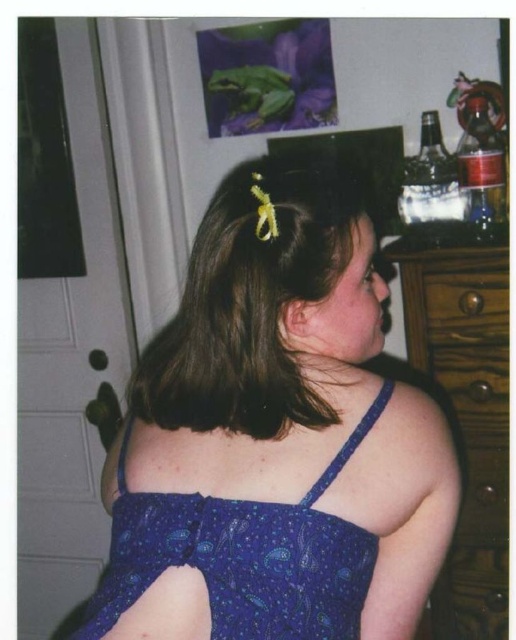
Question: Which of these objects is positioned closest to the brown wooden drawer at right?

Choices:
 (A) blue satin dress at center
 (B) wooden dresser at right

Answer: (B)

Question: Does brown matte hair clip at upper center have a smaller size compared to wooden dresser at right?

Choices:
 (A) no
 (B) yes

Answer: (B)

Question: Which of the following is the closest to the observer?

Choices:
 (A) (307, 316)
 (B) (457, 272)

Answer: (A)

Question: Is blue paisley fabric dress at back thinner than wooden dresser at right?

Choices:
 (A) no
 (B) yes

Answer: (A)

Question: Is wooden dresser at right further to camera compared to brown wooden drawer at right?

Choices:
 (A) yes
 (B) no

Answer: (B)

Question: Among these objects, which one is nearest to the camera?

Choices:
 (A) brown wooden drawer at right
 (B) brown matte hair clip at upper center

Answer: (B)